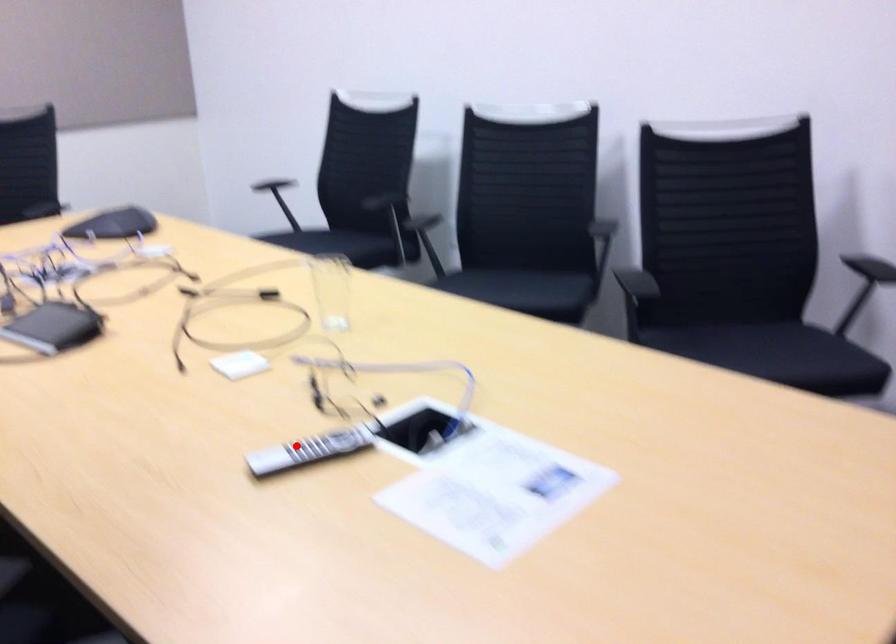
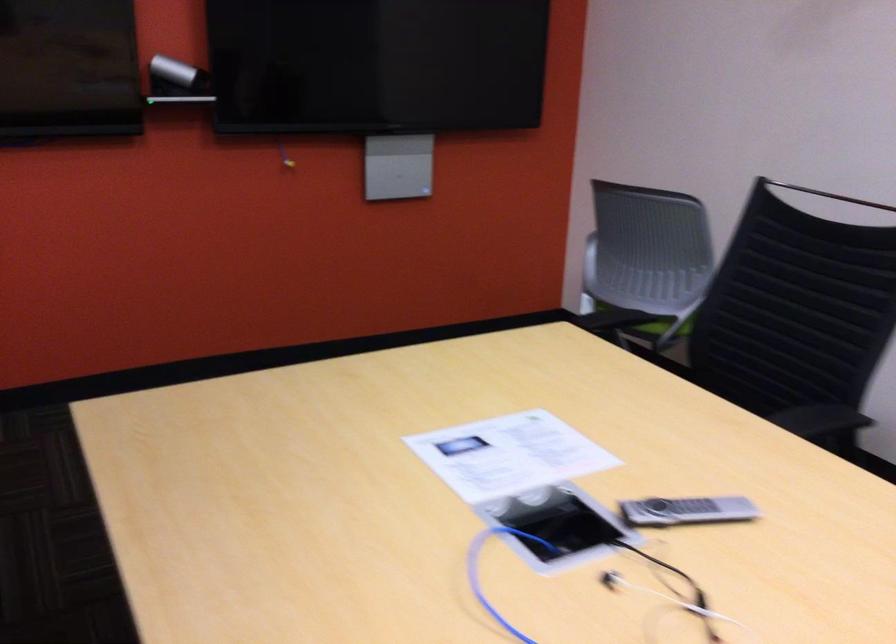
Question: I am providing you with two images of the same scene from different viewpoints. A red point is marked on the first image. Is the red point's position out of view in image 2?

Choices:
 (A) Yes
 (B) No

Answer: (B)